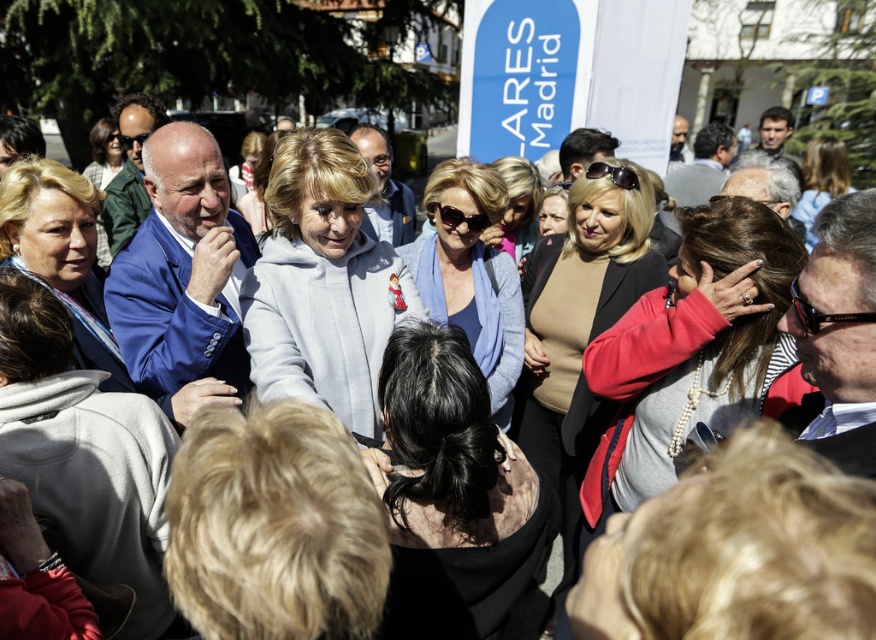
Between beige sweater at center and matte gray hoodie at center, which one is positioned lower?

beige sweater at center

Where is `beige sweater at center`? This screenshot has height=640, width=876. beige sweater at center is located at coordinates (580, 324).

Which is in front, point (778, 355) or point (811, 216)?

Positioned in front is point (778, 355).

Describe the element at coordinates (696, 352) in the screenshot. I see `pearl necklace at center` at that location.

Who is more distant from viewer, (761, 205) or (821, 195)?

Point (821, 195)

I want to click on pearl necklace at center, so click(696, 352).

Based on the photo, who is shorter, matte blue suit at center or matte gray hoodie at center?

With less height is matte gray hoodie at center.

The height and width of the screenshot is (640, 876). What do you see at coordinates (61, 252) in the screenshot?
I see `matte blue suit at center` at bounding box center [61, 252].

Where is `matte blue suit at center`? Image resolution: width=876 pixels, height=640 pixels. matte blue suit at center is located at coordinates (61, 252).